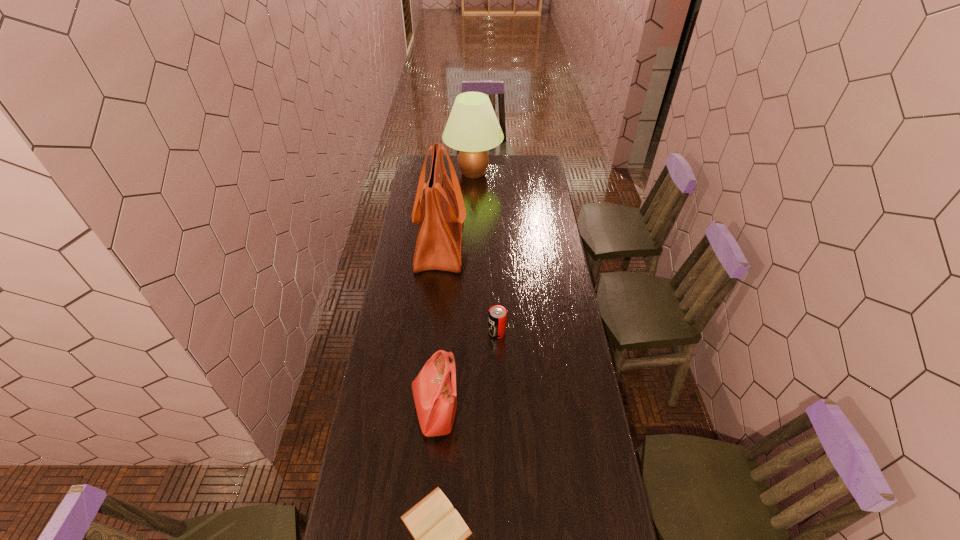
This screenshot has height=540, width=960. I want to click on free spot between the can and the handbag, so click(466, 371).

Image resolution: width=960 pixels, height=540 pixels. What are the coordinates of `vacant point located between the second farthest object and the second nearest object` in the screenshot? It's located at (438, 326).

Where is `object that is the second closest to the diary`? Image resolution: width=960 pixels, height=540 pixels. object that is the second closest to the diary is located at coordinates (497, 316).

Identify which object is located as the second nearest to the shortest object. Please provide its 2D coordinates. Your answer should be formatted as a tuple, i.e. [(x, y)], where the tuple contains the x and y coordinates of a point satisfying the conditions above.

[(497, 316)]

Image resolution: width=960 pixels, height=540 pixels. Find the location of `vacant region that satisfies the following two spatial constraints: 1. on the shade of the farthest object; 2. on the back side of the fourth tallest object`. vacant region that satisfies the following two spatial constraints: 1. on the shade of the farthest object; 2. on the back side of the fourth tallest object is located at coordinates (470, 333).

What are the coordinates of `blank space that satisfies the following two spatial constraints: 1. on the front pocket of the fourth nearest object; 2. on the left side of the third farthest object` in the screenshot? It's located at (431, 333).

Where is `vacant area that satisfies the following two spatial constraints: 1. on the shade of the farthest object; 2. on the back side of the fourth tallest object`? The height and width of the screenshot is (540, 960). vacant area that satisfies the following two spatial constraints: 1. on the shade of the farthest object; 2. on the back side of the fourth tallest object is located at coordinates (470, 333).

Image resolution: width=960 pixels, height=540 pixels. I want to click on free point that satisfies the following two spatial constraints: 1. on the shade of the second shortest object; 2. on the right side of the lampshade, so click(x=470, y=333).

The width and height of the screenshot is (960, 540). What are the coordinates of `vacant area in the image that satisfies the following two spatial constraints: 1. on the front pocket of the third farthest object; 2. on the left side of the shopping bag` in the screenshot? It's located at (431, 333).

Find the location of a particular element. vacant space that satisfies the following two spatial constraints: 1. on the back side of the can; 2. on the front pocket of the shopping bag is located at coordinates (493, 242).